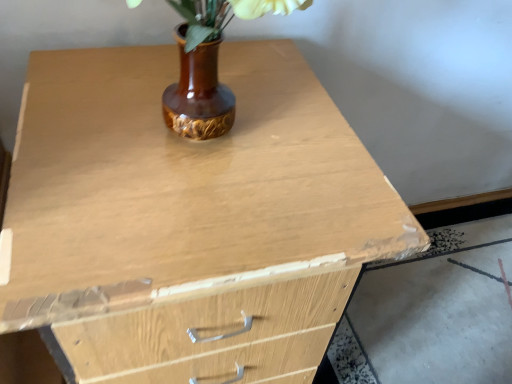
At what (x,y) coordinates should I click in order to perform the action: click on free space behind browny-golden ceramic vase at center. Please return your answer as a coordinate pair (x, y). The height and width of the screenshot is (384, 512). Looking at the image, I should click on (234, 66).